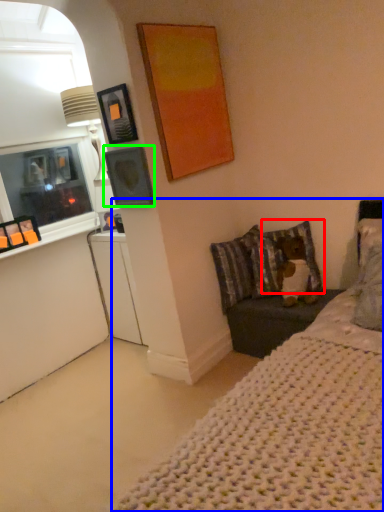
Question: Which object is positioned farthest from pillow (highlighted by a red box)? Select from bed (highlighted by a blue box) and picture frame (highlighted by a green box).

Choices:
 (A) bed
 (B) picture frame

Answer: (A)